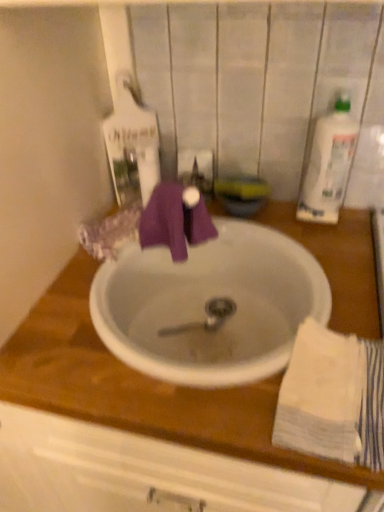
I want to click on vacant area in front of white plastic bottle at upper right, so click(x=335, y=253).